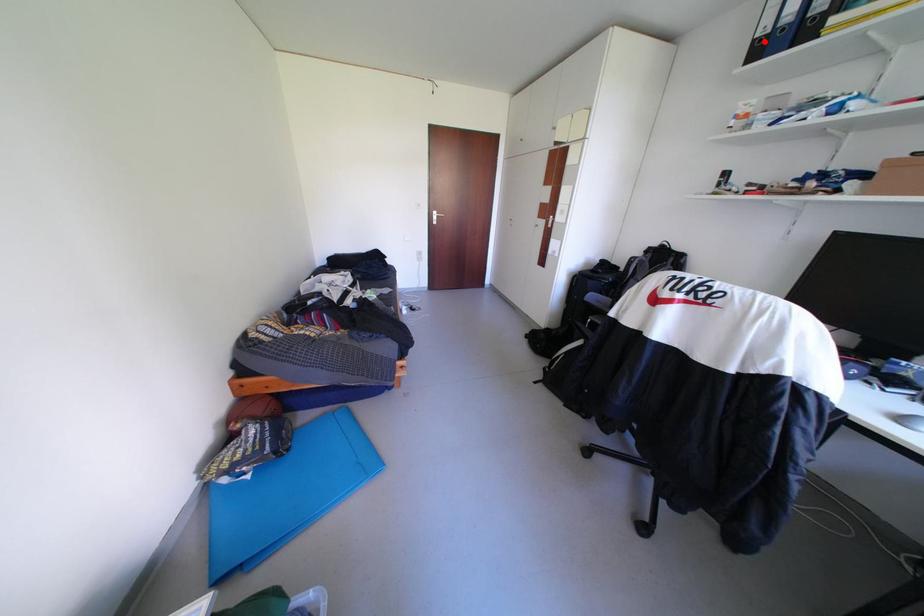
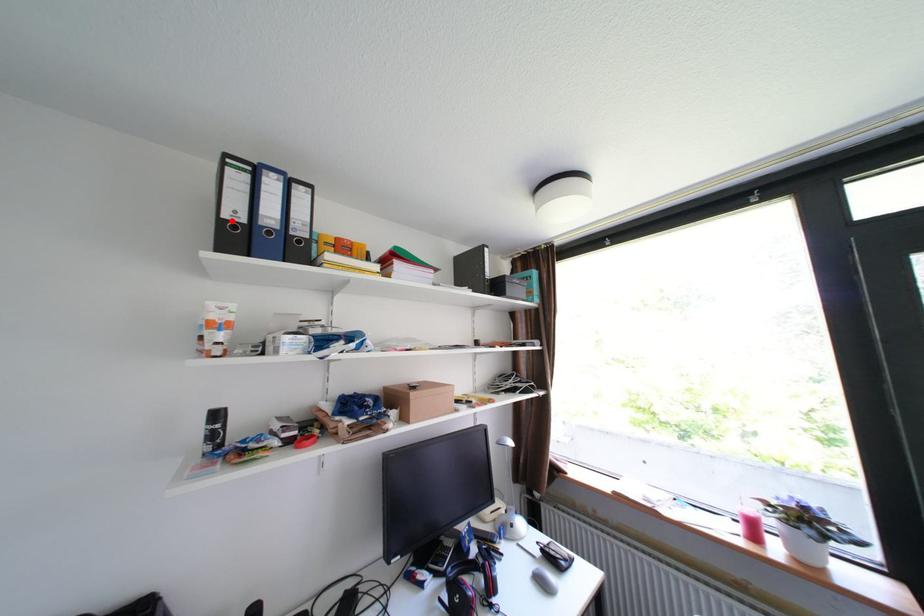
I am providing you with two images of the same scene from different viewpoints. A red point is marked on the first image and another point is marked on the second image. Are the points marked in image1 and image2 representing the same 3D position?

Yes